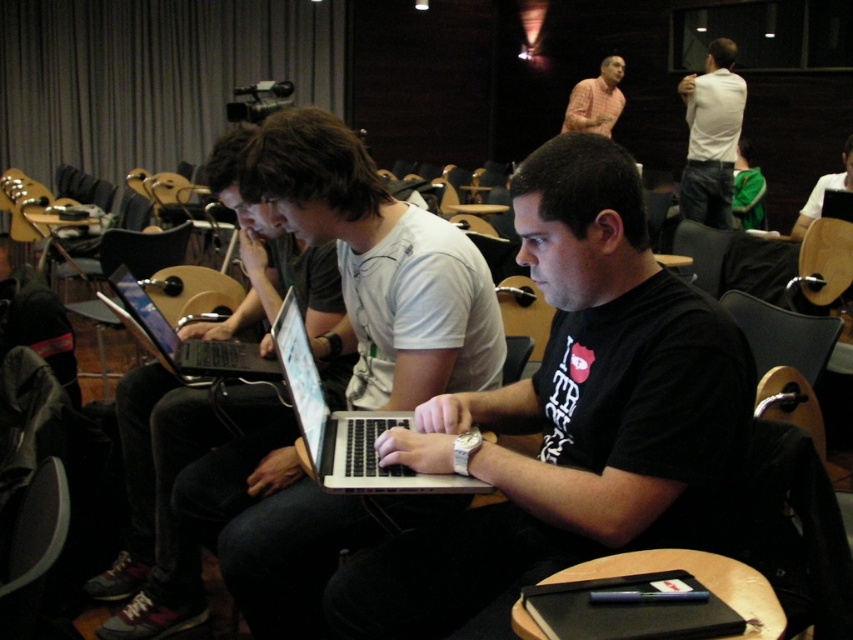
You are standing in the lecture hall and want to determine which of the two points, point (396, 468) or point (602, 76), is closer to you. Based on the scene description, which point is nearer?

Point (396, 468) is closer to the camera than point (602, 76).